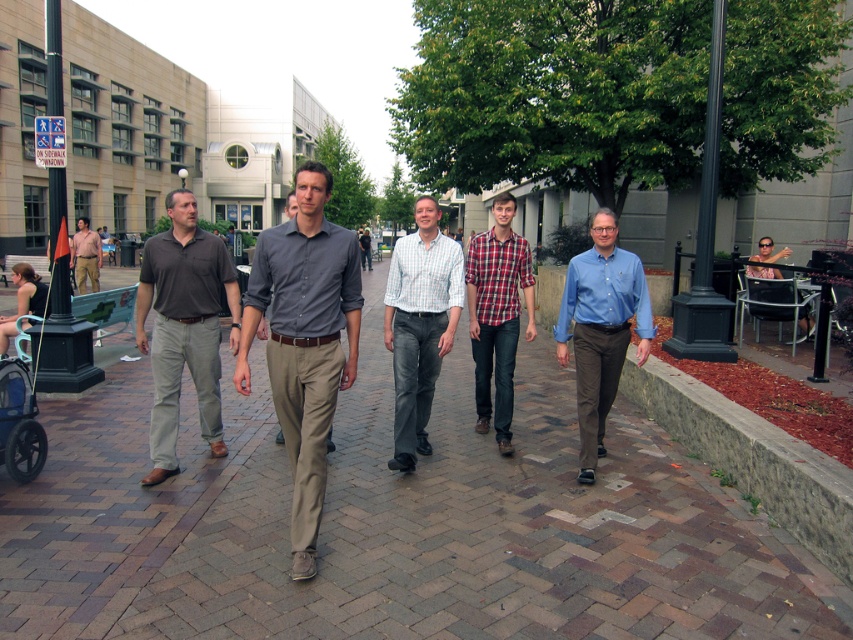
Question: Is matte brown pants at left wider than blue cotton shirt at right?

Choices:
 (A) yes
 (B) no

Answer: (A)

Question: Among these points, which one is farthest from the camera?

Choices:
 (A) (614, 381)
 (B) (96, 268)
 (C) (173, 460)
 (D) (292, 253)

Answer: (B)

Question: Can you confirm if matte brown pants at left is positioned above blue plastic baby carriage at lower left?

Choices:
 (A) yes
 (B) no

Answer: (A)

Question: Does brick pavement at center appear over matte khaki pants at center?

Choices:
 (A) no
 (B) yes

Answer: (A)

Question: Which object is closer to the camera taking this photo?

Choices:
 (A) blue plastic baby carriage at lower left
 (B) light blue checkered shirt at center
 (C) blue cotton shirt at right
 (D) matte brown shirt at left

Answer: (A)

Question: Which object is the closest to the plaid cotton shirt at center?

Choices:
 (A) blue cotton shirt at right
 (B) matte brown pants at left
 (C) brick pavement at center

Answer: (A)